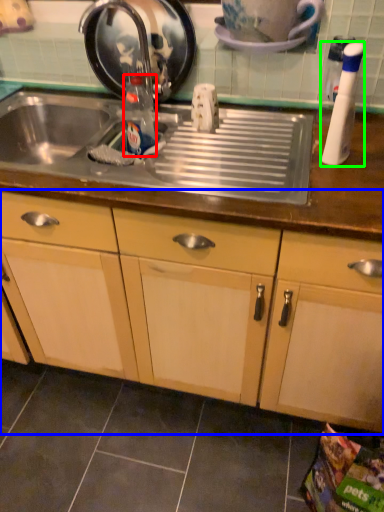
Question: Which object is the farthest from bottle (highlighted by a red box)? Choose among these: cabinetry (highlighted by a blue box) or bottle (highlighted by a green box).

Choices:
 (A) cabinetry
 (B) bottle

Answer: (A)